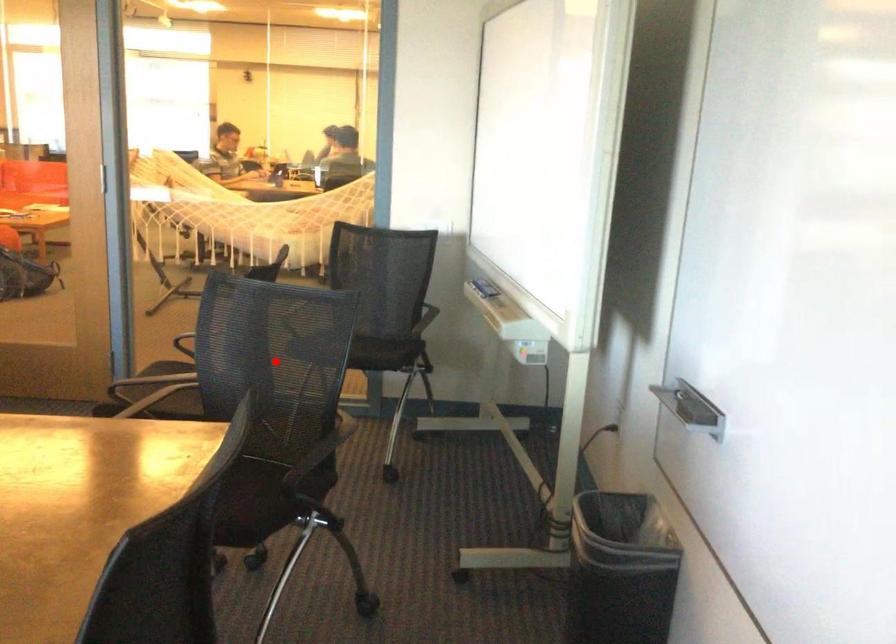
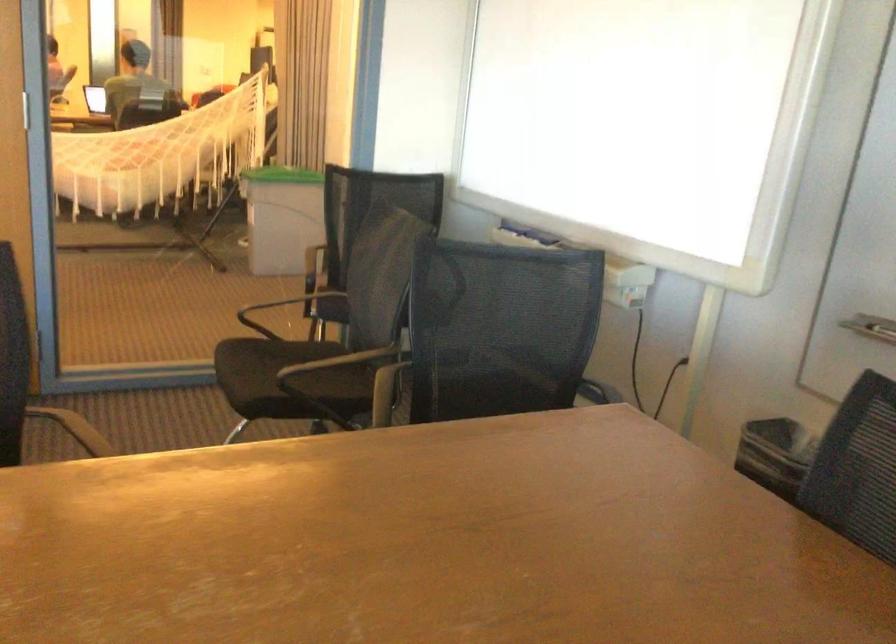
Question: I am providing you with two images of the same scene from different viewpoints. A red point is marked on the first image. Is the red point's position out of view in image 2?

Choices:
 (A) Yes
 (B) No

Answer: (B)